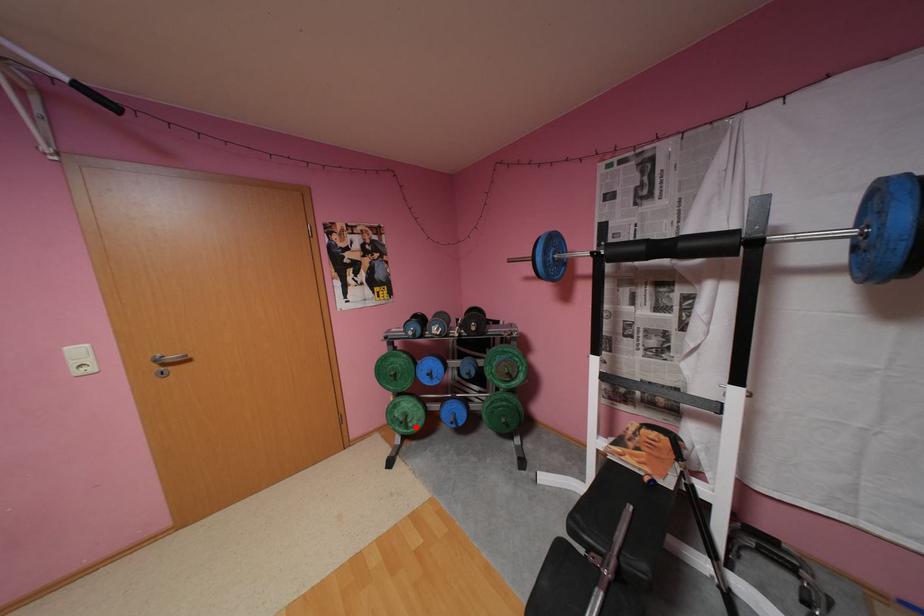
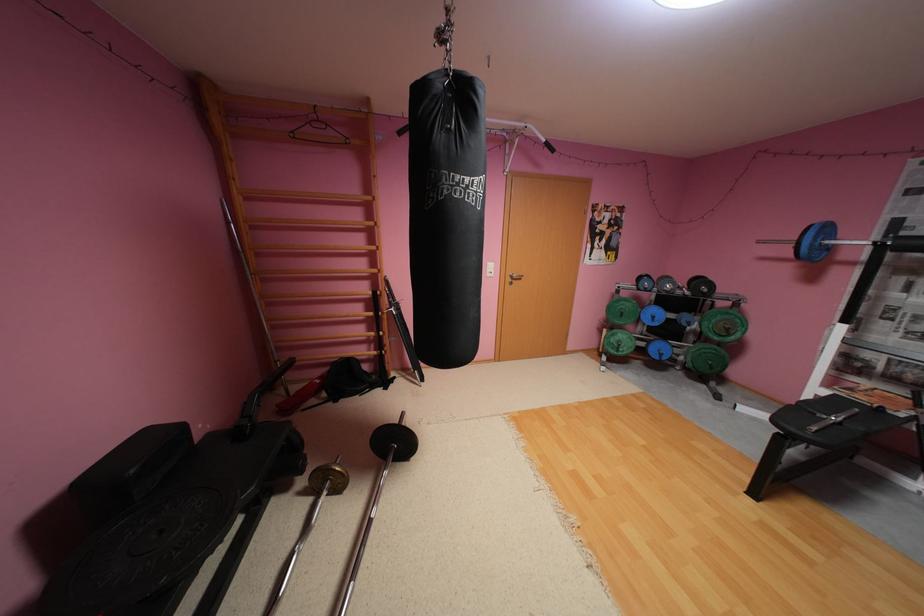
Where in the second image is the point corresponding to the highlighted location from the first image?

(626, 351)